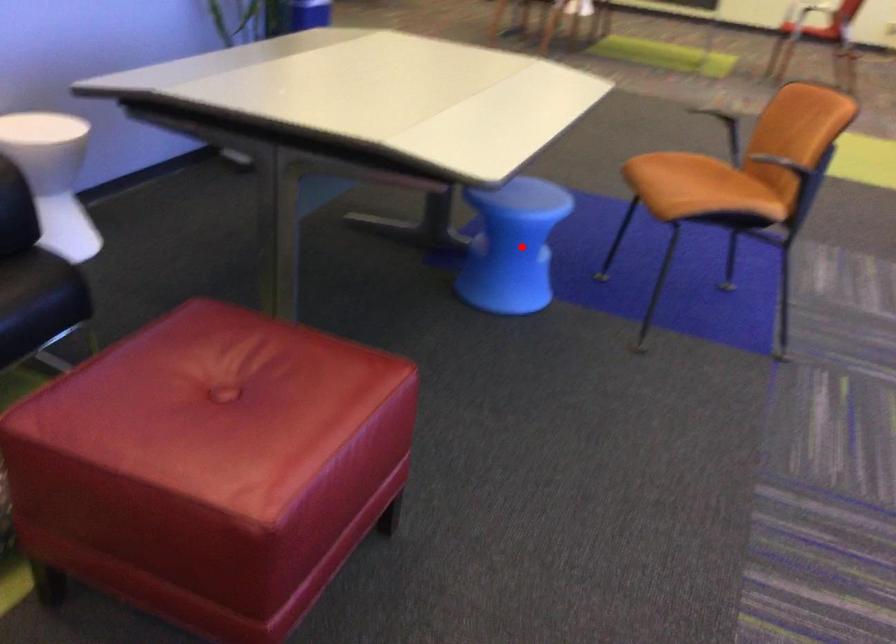
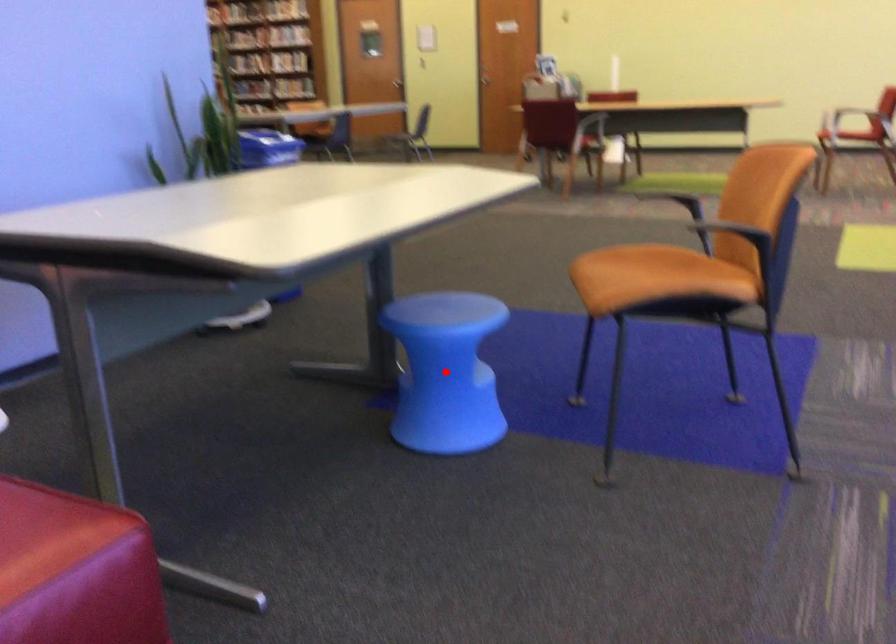
I am providing you with two images of the same scene from different viewpoints. A red point is marked on the first image and another point is marked on the second image. Is the red point in image1 aligned with the point shown in image2?

Yes